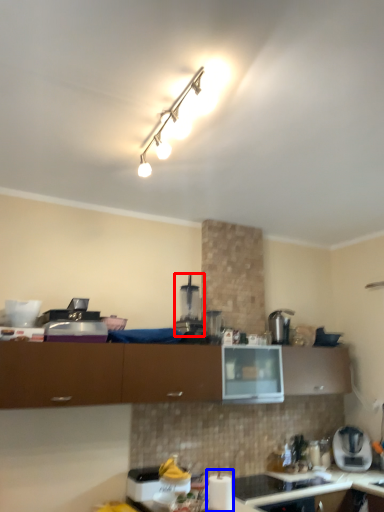
Question: Which object appears farthest to the camera in this image, coffee machine (highlighted by a red box) or appliance (highlighted by a blue box)?

Choices:
 (A) coffee machine
 (B) appliance

Answer: (A)